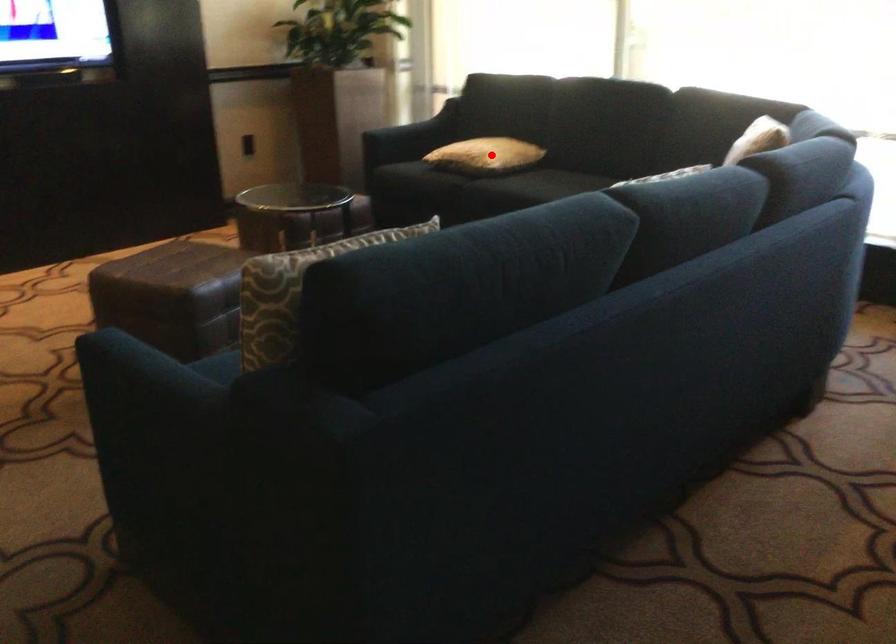
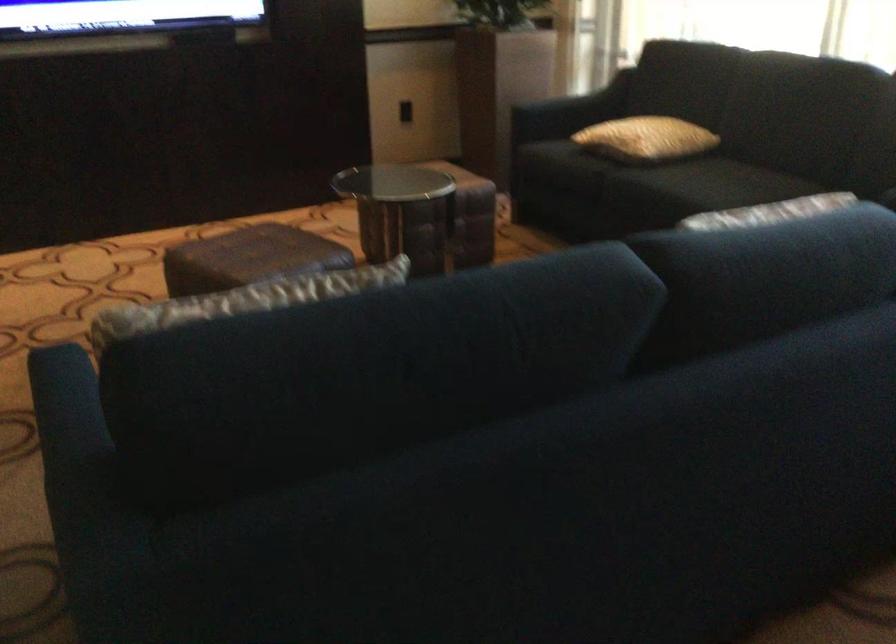
Locate, in the second image, the point that corresponds to the highlighted location in the first image.

(645, 138)